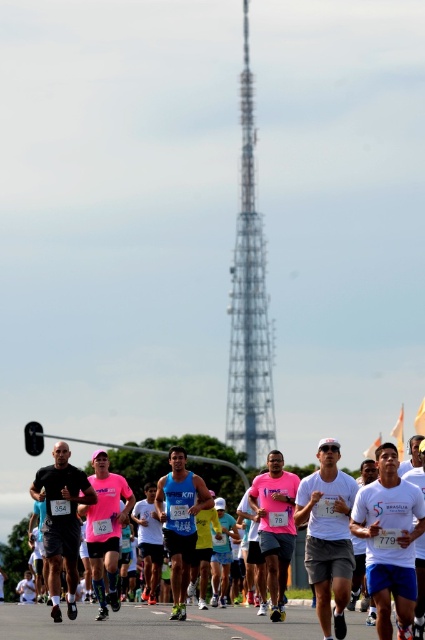
You are a photographer positioned at the starting line of the marathon. You want to capture a photo that includes both the metallic silver tower at center and the white matte shirt at center. Based on their positions, which object should you adjust your camera focus to ensure it appears in the background?

The metallic silver tower at center is above the white matte shirt at center, so to have the tower in the background, you should focus on the white matte shirt at center first.

You are a photographer standing at the starting line of the marathon. You want to capture a photo that includes both the metallic silver tower at center and the white matte shirt at center. Based on their positions, which object should you adjust your camera to focus on first to ensure both are in the frame?

The metallic silver tower at center is positioned on the right side of the white matte shirt at center. To include both in the frame, focus on the white matte shirt at center first since it is closer to the photographer, and the tower will naturally be on its right in the background.

You are a photographer positioned at the starting line of the marathon. You want to take a photo that includes both the metallic silver tower at center and the white matte shirt at center. Which object should you adjust your camera focus on first to ensure both are in the frame?

The metallic silver tower at center is further to the viewer than the white matte shirt at center, so you should focus on the metallic silver tower at center first to ensure both are in the frame.